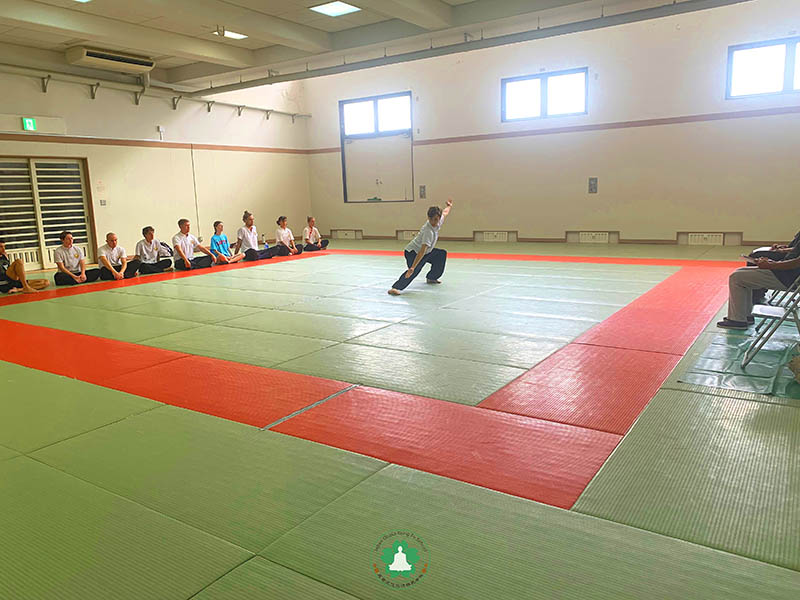
This screenshot has height=600, width=800. What are the coordinates of `wall` in the screenshot? It's located at (150, 188), (461, 168).